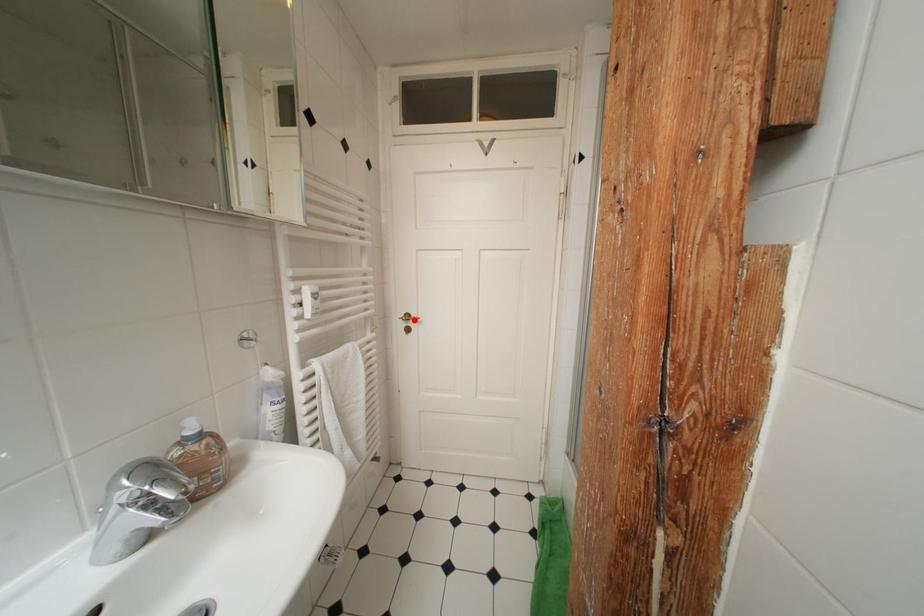
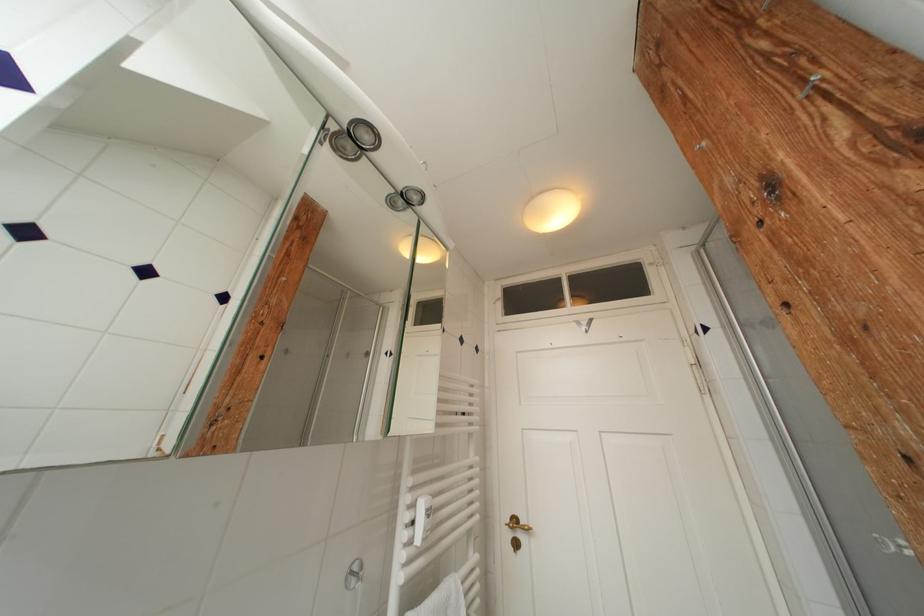
Locate, in the second image, the point that corresponds to the highlighted location in the first image.

(521, 525)